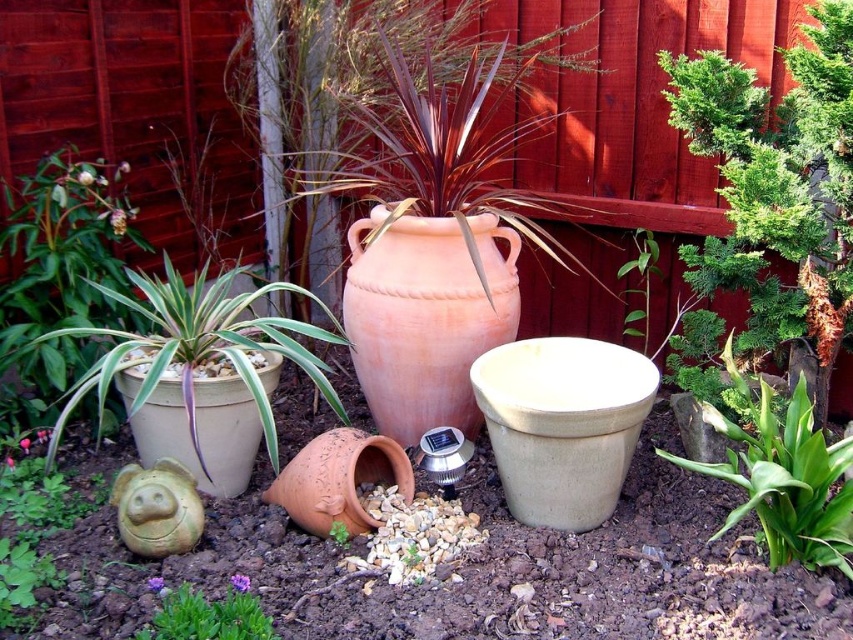
Does green glossy leafy plant at lower right have a lesser width compared to green matte succulent at center?

No, green glossy leafy plant at lower right is not thinner than green matte succulent at center.

Is green glossy leafy plant at lower right to the left of green matte succulent at center from the viewer's perspective?

Incorrect, green glossy leafy plant at lower right is not on the left side of green matte succulent at center.

Describe the element at coordinates (782, 476) in the screenshot. The width and height of the screenshot is (853, 640). I see `green glossy leafy plant at lower right` at that location.

What are the coordinates of `green glossy leafy plant at lower right` in the screenshot? It's located at (782, 476).

Which is more to the left, matte ceramic pig at lower left or terracotta clay pot at center?

matte ceramic pig at lower left is more to the left.

Who is positioned more to the right, matte ceramic pig at lower left or terracotta clay pot at center?

terracotta clay pot at center is more to the right.

Is point (224, 477) closer to viewer compared to point (276, 493)?

No, it is behind (276, 493).

Where is `matte ceramic pig at lower left`? The height and width of the screenshot is (640, 853). matte ceramic pig at lower left is located at coordinates (202, 426).

Is point (51, 323) more distant than point (276, 492)?

Yes, point (51, 323) is behind point (276, 492).

Between green leafy plant at left and terracotta clay pot at center, which one is positioned higher?

green leafy plant at left

Locate an element on the screen. The height and width of the screenshot is (640, 853). green leafy plant at left is located at coordinates (59, 280).